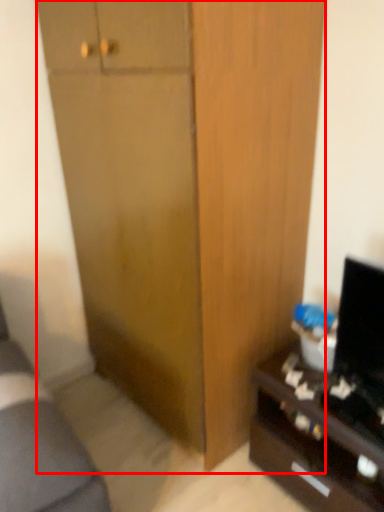
Question: Where is cabinetry (annotated by the red box) located in relation to desk in the image?

Choices:
 (A) left
 (B) right

Answer: (A)